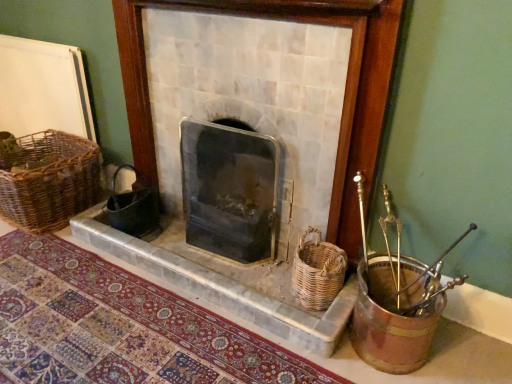
Question: Can woven brown basket at left, which is the first basket in left-to-right order, be found inside white marble fireplace at center?

Choices:
 (A) no
 (B) yes

Answer: (A)

Question: Considering the relative sizes of white marble fireplace at center and woven brown basket at left, which appears as the 2th basket when viewed from the right, in the image provided, is white marble fireplace at center smaller than woven brown basket at left, which appears as the 2th basket when viewed from the right,?

Choices:
 (A) no
 (B) yes

Answer: (A)

Question: From the image's perspective, does white marble fireplace at center appear higher than woven brown basket at left, which is the first basket in left-to-right order?

Choices:
 (A) yes
 (B) no

Answer: (A)

Question: Is white marble fireplace at center touching woven brown basket at left, marked as the first basket in a back-to-front arrangement?

Choices:
 (A) no
 (B) yes

Answer: (A)

Question: From a real-world perspective, is white marble fireplace at center on top of woven brown basket at left, the second basket from the front?

Choices:
 (A) no
 (B) yes

Answer: (B)

Question: Is white marble fireplace at center positioned far away from woven brown basket at left, which appears as the 2th basket when viewed from the right?

Choices:
 (A) yes
 (B) no

Answer: (B)

Question: Is black wicker gift basket at center looking in the opposite direction of white marble fireplace at center?

Choices:
 (A) yes
 (B) no

Answer: (A)

Question: Is black wicker gift basket at center oriented towards white marble fireplace at center?

Choices:
 (A) yes
 (B) no

Answer: (B)

Question: Is black wicker gift basket at center beside white marble fireplace at center?

Choices:
 (A) yes
 (B) no

Answer: (B)

Question: Does black wicker gift basket at center appear on the right side of white marble fireplace at center?

Choices:
 (A) no
 (B) yes

Answer: (A)

Question: Is black wicker gift basket at center wider than white marble fireplace at center?

Choices:
 (A) yes
 (B) no

Answer: (A)

Question: From the image's perspective, is black wicker gift basket at center on top of white marble fireplace at center?

Choices:
 (A) no
 (B) yes

Answer: (A)

Question: Does black glass wood burning stove at center lie in front of black wicker gift basket at center?

Choices:
 (A) no
 (B) yes

Answer: (B)